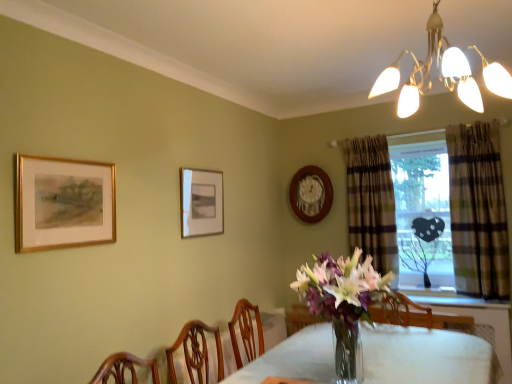
Locate an element on the screen. The image size is (512, 384). matte gold picture frame at center, arranged as the 2th picture frame when viewed from the back is located at coordinates (201, 202).

Describe the element at coordinates (63, 203) in the screenshot. I see `gold-framed painting at upper left, acting as the 3th picture frame starting from the right` at that location.

You are a GUI agent. You are given a task and a screenshot of the screen. Output one action in this format:
    pyautogui.click(x=<x>, y=<y>)
    Task: Click on the plaid fabric curtain at right, arranged as the first curtain when viewed from the front
    Image resolution: width=512 pixels, height=384 pixels.
    Given the screenshot: What is the action you would take?
    (x=478, y=211)

What is the approximate width of white glossy chandelier at upper right?

It is 19.81 inches.

Where is `clear glass table at center`? clear glass table at center is located at coordinates (424, 356).

Is gold-framed painting at upper left, acting as the 3th picture frame starting from the right, surrounded by clear glass table at center?

Actually, gold-framed painting at upper left, acting as the 3th picture frame starting from the right, is outside clear glass table at center.

Looking at this image, are clear glass table at center and gold-framed painting at upper left, positioned as the 1th picture frame in front-to-back order, making contact?

No, clear glass table at center is not in contact with gold-framed painting at upper left, positioned as the 1th picture frame in front-to-back order.

How different are the orientations of clear glass table at center and gold-framed painting at upper left, the first picture frame from the left, in degrees?

87.3 degrees.

Is clear glass table at center looking in the opposite direction of gold-framed painting at upper left, acting as the 3th picture frame starting from the right?

That's not correct — clear glass table at center is not looking away from gold-framed painting at upper left, acting as the 3th picture frame starting from the right.

Is white glossy chandelier at upper right located outside plaid fabric curtain at right, marked as the second curtain in a left-to-right arrangement?

Yes, white glossy chandelier at upper right is not within plaid fabric curtain at right, marked as the second curtain in a left-to-right arrangement.

Based on the photo, how many degrees apart are the facing directions of white glossy chandelier at upper right and plaid fabric curtain at right, the 2th curtain when ordered from back to front?

The facing directions of white glossy chandelier at upper right and plaid fabric curtain at right, the 2th curtain when ordered from back to front, are 91.1 degrees apart.

Is the position of white glossy chandelier at upper right more distant than that of plaid fabric curtain at right, arranged as the first curtain when viewed from the front?

No, white glossy chandelier at upper right is closer to the viewer.

Is white glossy chandelier at upper right not close to plaid fabric curtain at right, arranged as the first curtain when viewed from the front?

Yes, white glossy chandelier at upper right and plaid fabric curtain at right, arranged as the first curtain when viewed from the front, are located far from each other.

Is clear glass table at center bigger than plaid fabric curtain at right, arranged as the first curtain when viewed from the front?

Indeed, clear glass table at center has a larger size compared to plaid fabric curtain at right, arranged as the first curtain when viewed from the front.

Is the depth of clear glass table at center less than that of plaid fabric curtain at right, the 2th curtain when ordered from back to front?

Yes, it is in front of plaid fabric curtain at right, the 2th curtain when ordered from back to front.

From a real-world perspective, is clear glass table at center on plaid fabric curtain at right, the 2th curtain when ordered from back to front?

Incorrect, from a real-world perspective, clear glass table at center is lower than plaid fabric curtain at right, the 2th curtain when ordered from back to front.

Which object is further away from the camera taking this photo, plaid fabric curtain at right, the 2th curtain when ordered from back to front, or transparent glass heart at center?

transparent glass heart at center is behind.

Is plaid fabric curtain at right, the 2th curtain when ordered from back to front, far from transparent glass heart at center?

No.

Which object is positioned more to the left, plaid fabric curtain at right, arranged as the first curtain when viewed from the front, or transparent glass heart at center?

transparent glass heart at center.

Is transparent glass heart at center at the back of plaid fabric curtain at right, marked as the second curtain in a left-to-right arrangement?

No.

From the image's perspective, is wooden clock at upper center, the third picture frame from the front, over white glossy chandelier at upper right?

Actually, wooden clock at upper center, the third picture frame from the front, appears below white glossy chandelier at upper right in the image.

From the picture: Which object is more forward, wooden clock at upper center, which is counted as the first picture frame, starting from the back, or white glossy chandelier at upper right?

white glossy chandelier at upper right.

Could you tell me if wooden clock at upper center, acting as the 1th picture frame starting from the right, is facing white glossy chandelier at upper right?

No, wooden clock at upper center, acting as the 1th picture frame starting from the right, is not turned towards white glossy chandelier at upper right.

Considering the positions of objects matte gold picture frame at center, arranged as the 2th picture frame when viewed from the back, and gold-framed painting at upper left, placed as the third picture frame when sorted from back to front, in the image provided, who is behind, matte gold picture frame at center, arranged as the 2th picture frame when viewed from the back, or gold-framed painting at upper left, placed as the third picture frame when sorted from back to front,?

matte gold picture frame at center, arranged as the 2th picture frame when viewed from the back, is more distant.

From the image's perspective, is matte gold picture frame at center, which appears as the 2th picture frame when viewed from the right, positioned above or below gold-framed painting at upper left, the first picture frame from the left?

matte gold picture frame at center, which appears as the 2th picture frame when viewed from the right, is situated lower than gold-framed painting at upper left, the first picture frame from the left, in the image.

Which is behind, point (215, 171) or point (93, 212)?

The point (215, 171) is more distant.

Which object is positioned more to the right, matte gold picture frame at center, which ranks as the 2th picture frame in left-to-right order, or gold-framed painting at upper left, acting as the 3th picture frame starting from the right?

matte gold picture frame at center, which ranks as the 2th picture frame in left-to-right order, is more to the right.

The height and width of the screenshot is (384, 512). Identify the location of table directly beneath the transparent glass heart at center (from a real-world perspective). tap(424, 356).

From a real-world perspective, is transparent glass heart at center over clear glass table at center?

Yes, from a real-world perspective, transparent glass heart at center is on top of clear glass table at center.

Which is less distant, [436,140] or [438,361]?

Point [436,140].

Which object is closer to the camera taking this photo, transparent glass heart at center or clear glass table at center?

clear glass table at center is closer to the camera.

What are the coordinates of `table on the right of gold-framed painting at upper left, positioned as the 1th picture frame in front-to-back order` in the screenshot? It's located at (424, 356).

Where is `the 1st curtain behind the white glossy chandelier at upper right`? the 1st curtain behind the white glossy chandelier at upper right is located at coordinates (478, 211).

Looking at the image, which one is located closer to plaid fabric curtain at right, which ranks as the 1th curtain in back-to-front order, clear glass table at center or matte gold picture frame at center, which appears as the 2th picture frame when viewed from the right?

clear glass table at center lies closer to plaid fabric curtain at right, which ranks as the 1th curtain in back-to-front order, than the other object.

Consider the image. Looking at the image, which one is located closer to wooden clock at upper center, the third picture frame from the front, transparent glass heart at center or matte gold picture frame at center, arranged as the 2th picture frame when viewed from the back?

Based on the image, transparent glass heart at center appears to be nearer to wooden clock at upper center, the third picture frame from the front.

Based on their spatial positions, is plaid fabric curtain at right, which is the 2th curtain in front-to-back order, or matte gold picture frame at center, which ranks as the 2th picture frame in left-to-right order, closer to wooden clock at upper center, the third picture frame from the front?

Based on the image, plaid fabric curtain at right, which is the 2th curtain in front-to-back order, appears to be nearer to wooden clock at upper center, the third picture frame from the front.

From the image, which object appears to be farther from plaid fabric curtain at right, the 1th curtain when ordered from right to left, gold-framed painting at upper left, placed as the third picture frame when sorted from back to front, or transparent glass heart at center?

gold-framed painting at upper left, placed as the third picture frame when sorted from back to front, is further to plaid fabric curtain at right, the 1th curtain when ordered from right to left.

Which object lies further to the anchor point plaid fabric curtain at right, the 2th curtain positioned from the right, gold-framed painting at upper left, placed as the third picture frame when sorted from back to front, or transparent glass heart at center?

The object further to plaid fabric curtain at right, the 2th curtain positioned from the right, is gold-framed painting at upper left, placed as the third picture frame when sorted from back to front.

When comparing their distances from transparent glass heart at center, does plaid fabric curtain at right, which ranks as the 1th curtain in back-to-front order, or gold-framed painting at upper left, the first picture frame from the left, seem closer?

Among the two, plaid fabric curtain at right, which ranks as the 1th curtain in back-to-front order, is located nearer to transparent glass heart at center.

When comparing their distances from white glossy chandelier at upper right, does wooden clock at upper center, the third picture frame from the front, or matte gold picture frame at center, which appears as the 2th picture frame when viewed from the right, seem closer?

Based on the image, matte gold picture frame at center, which appears as the 2th picture frame when viewed from the right, appears to be nearer to white glossy chandelier at upper right.

Based on their spatial positions, is white glossy chandelier at upper right or matte gold picture frame at center, which ranks as the 2th picture frame in left-to-right order, further from wooden clock at upper center, acting as the 1th picture frame starting from the right?

The object further to wooden clock at upper center, acting as the 1th picture frame starting from the right, is white glossy chandelier at upper right.

You are a GUI agent. You are given a task and a screenshot of the screen. Output one action in this format:
    pyautogui.click(x=<x>, y=<y>)
    Task: Click on the table between white glossy chandelier at upper right and transparent glass heart at center in the front-back direction
    
    Given the screenshot: What is the action you would take?
    pyautogui.click(x=424, y=356)

I want to click on window screen between gold-framed painting at upper left, positioned as the 1th picture frame in front-to-back order, and plaid fabric curtain at right, the 2th curtain when ordered from back to front, from left to right, so click(x=422, y=209).

Identify the location of window screen between plaid fabric curtain at right, which ranks as the 1th curtain in back-to-front order, and plaid fabric curtain at right, arranged as the first curtain when viewed from the front, from left to right. (422, 209).

Where is `picture frame between matte gold picture frame at center, arranged as the 2th picture frame when viewed from the back, and plaid fabric curtain at right, marked as the first curtain in a left-to-right arrangement`? The image size is (512, 384). picture frame between matte gold picture frame at center, arranged as the 2th picture frame when viewed from the back, and plaid fabric curtain at right, marked as the first curtain in a left-to-right arrangement is located at coordinates coord(311,194).